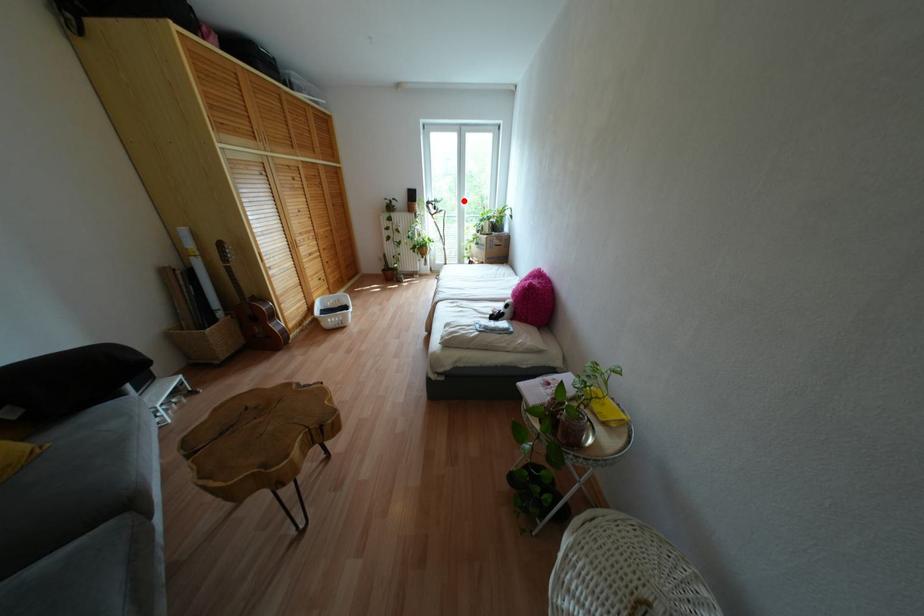
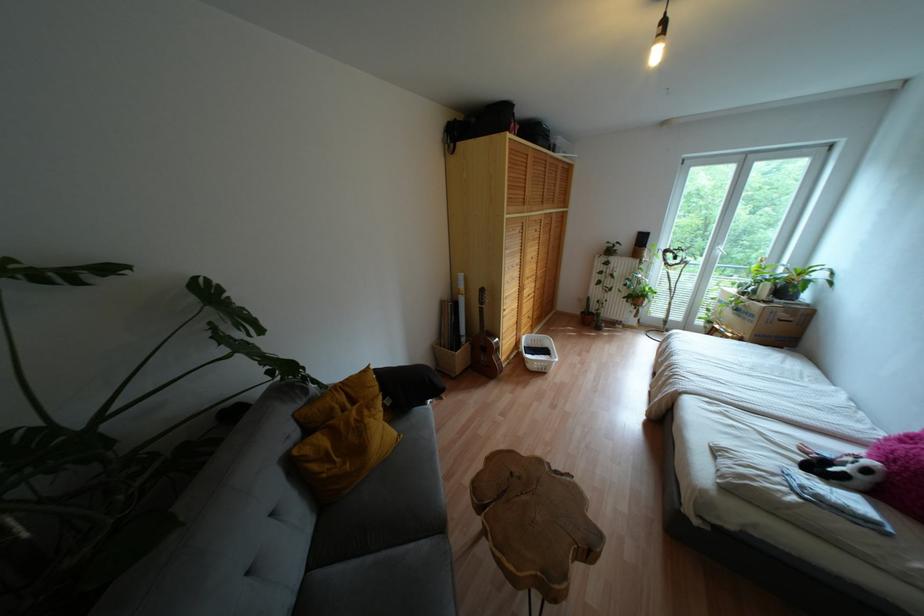
Question: A red point is marked in image1. In image2, is the corresponding 3D point closer to the camera or farther? Reply with the corresponding letter.

Choices:
 (A) The corresponding 3D point is closer.
 (B) The corresponding 3D point is farther.

Answer: (B)